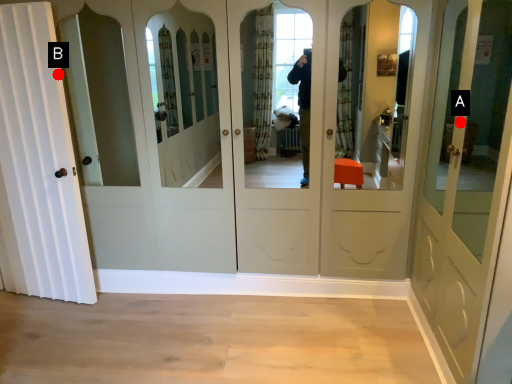
Question: Two points are circled on the image, labeled by A and B beside each circle. Among these points, which one is farthest from the camera?

Choices:
 (A) A is further
 (B) B is further

Answer: (B)